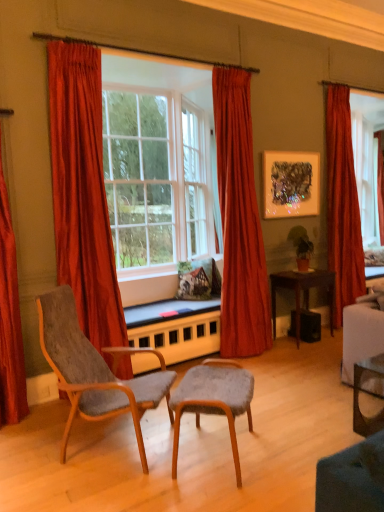
Image resolution: width=384 pixels, height=512 pixels. I want to click on vacant space that is to the left of textured gray fabric chair at lower left, which ranks as the first chair in left-to-right order, so click(31, 442).